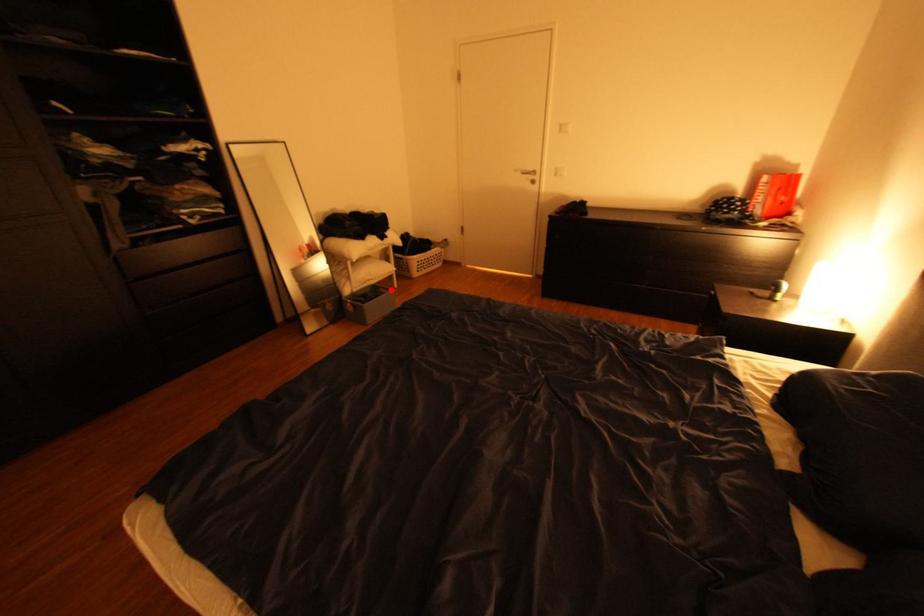
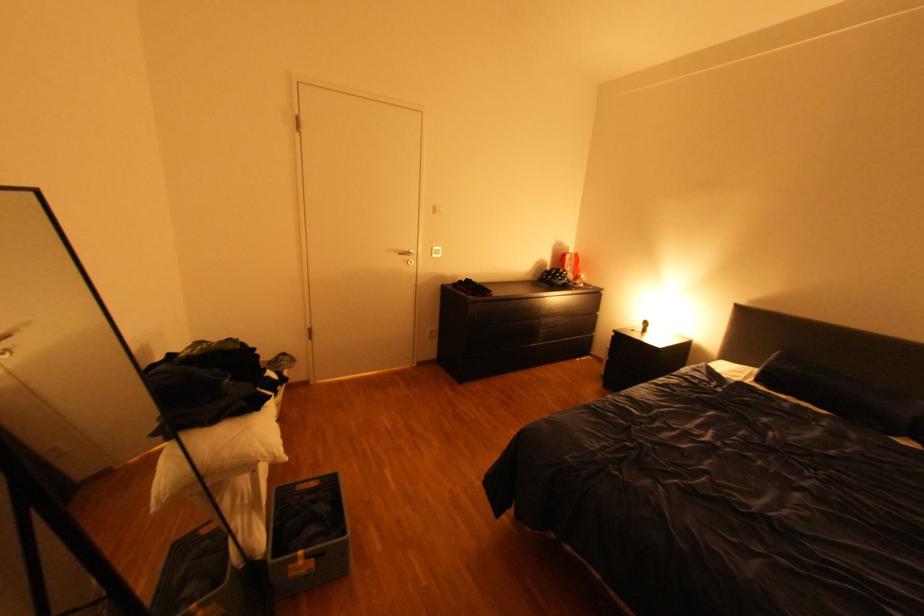
Question: I am providing you with two images of the same scene from different viewpoints. Image1 has a red point marked. In image2, the corresponding 3D location appears at what relative position? Reply with the corresponding letter.

Choices:
 (A) Closer
 (B) Farther

Answer: (A)